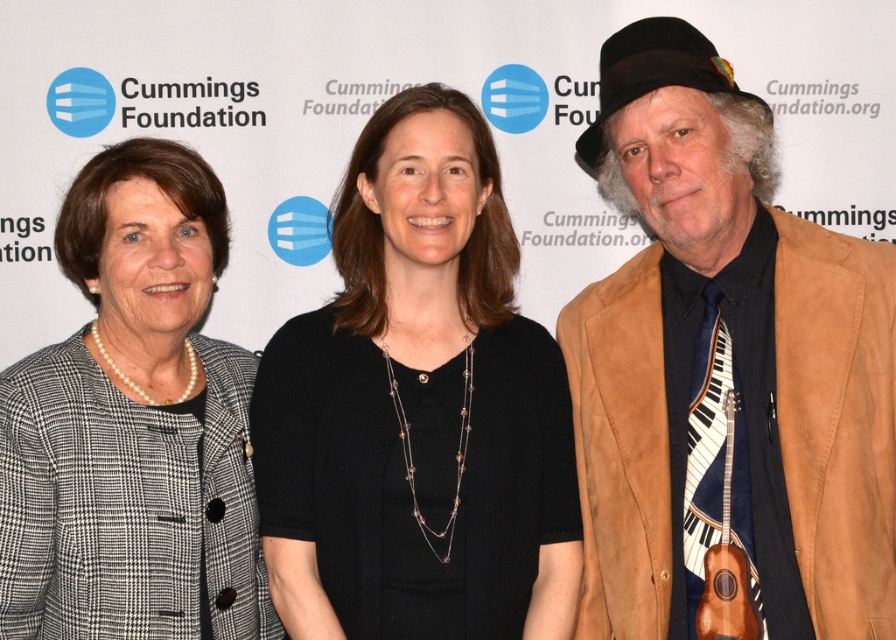
You are taking a photo of the three people standing against the Cummings Foundation backdrop. You want to focus on the person at point (x=876, y=445) and the person at point (x=93, y=211). Which of these two points should you adjust your camera focus to first if you want to ensure both are in focus?

Point (x=876, y=445) is closer to the camera than point (x=93, y=211), so you should focus on the person at point (x=876, y=445) first to ensure both are in focus.